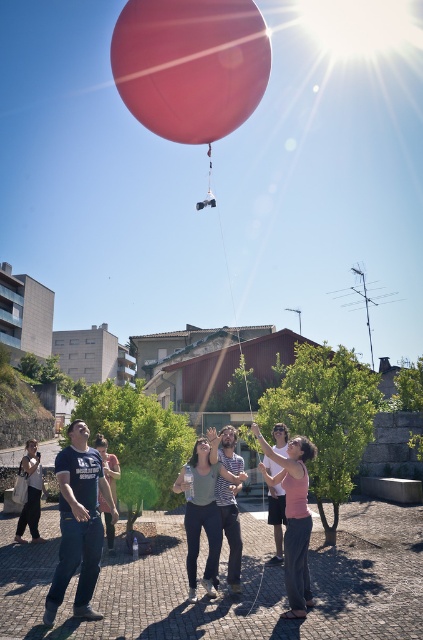
Question: In this image, where is rubber balloon at upper center located relative to matte blue t-shirt at center?

Choices:
 (A) above
 (B) below

Answer: (A)

Question: Does rubber balloon at upper center appear under matte green shirt at center?

Choices:
 (A) yes
 (B) no

Answer: (B)

Question: Is pink matte shirt at center bigger than matte white shirt at center?

Choices:
 (A) no
 (B) yes

Answer: (B)

Question: Which object appears closest to the camera in this image?

Choices:
 (A) matte white shirt at center
 (B) matte black t-shirt at lower left
 (C) striped shirt at center
 (D) rubber balloon at upper center

Answer: (C)

Question: Which object appears closest to the camera in this image?

Choices:
 (A) matte green shirt at center
 (B) matte white shirt at center
 (C) matte black t-shirt at lower left

Answer: (A)

Question: Which is nearer to the matte green shirt at center?

Choices:
 (A) matte blue t-shirt at center
 (B) matte black t-shirt at lower left

Answer: (A)